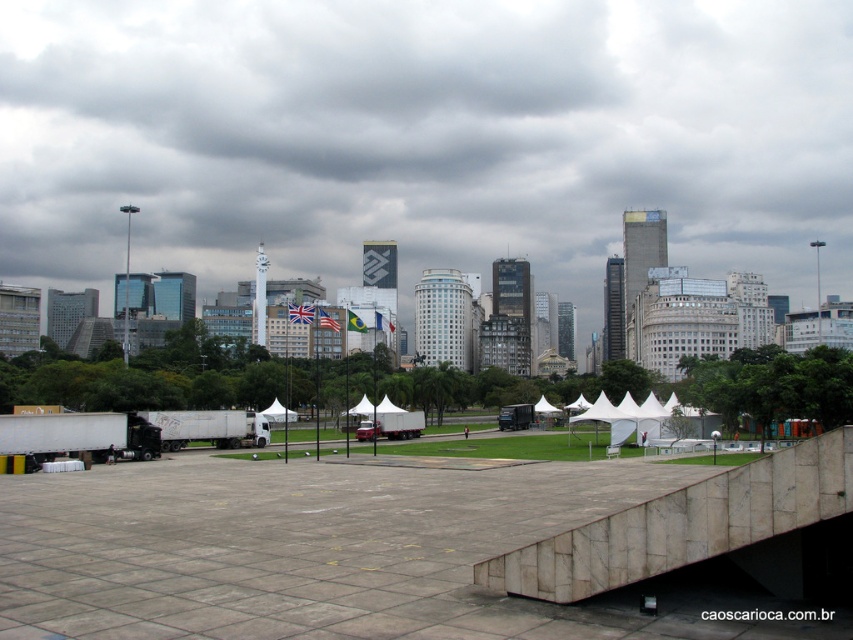
Question: Estimate the real-world distances between objects in this image. Which object is farther from the white canvas tent at center?

Choices:
 (A) white marble ramp at lower center
 (B) gray cloudy sky at upper center

Answer: (B)

Question: Does gray cloudy sky at upper center appear on the left side of white marble ramp at lower center?

Choices:
 (A) no
 (B) yes

Answer: (B)

Question: Which point appears farthest from the camera in this image?

Choices:
 (A) pyautogui.click(x=213, y=36)
 (B) pyautogui.click(x=383, y=412)

Answer: (A)

Question: Which object appears closest to the camera in this image?

Choices:
 (A) white marble ramp at lower center
 (B) gray cloudy sky at upper center

Answer: (A)

Question: Does gray cloudy sky at upper center appear on the right side of white marble ramp at lower center?

Choices:
 (A) no
 (B) yes

Answer: (A)

Question: Does gray cloudy sky at upper center have a greater width compared to white canvas tent at center?

Choices:
 (A) no
 (B) yes

Answer: (B)